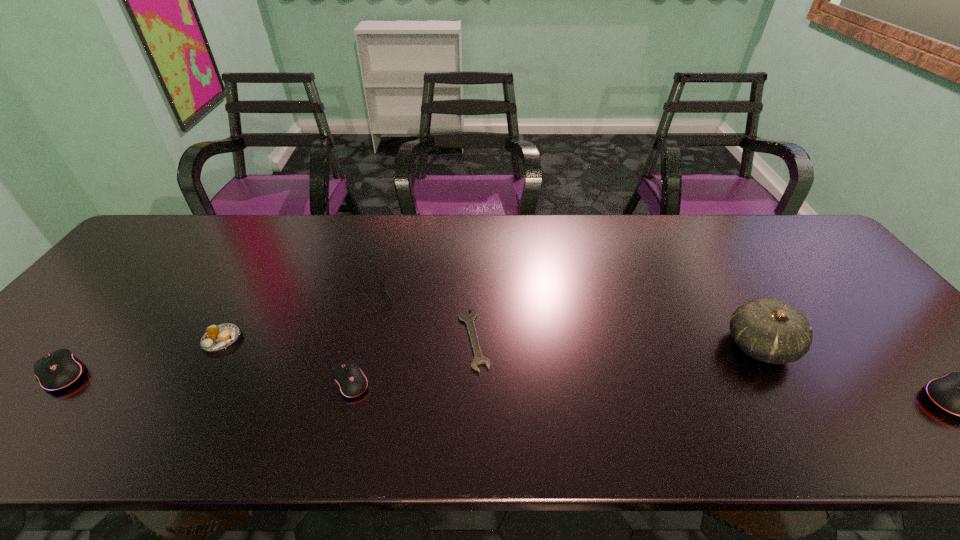
You are a GUI agent. You are given a task and a screenshot of the screen. Output one action in this format:
    pyautogui.click(x=<x>, y=<y>)
    Task: Click on the free spot at the left edge of the desktop
    This screenshot has height=540, width=960.
    Given the screenshot: What is the action you would take?
    pyautogui.click(x=22, y=373)

Locate an element on the screen. The width and height of the screenshot is (960, 540). blank area at the far left corner is located at coordinates pos(148,250).

Locate an element on the screen. The image size is (960, 540). unoccupied area between the second shortest object and the tallest object is located at coordinates (491, 343).

Find the location of `vacant space that's between the second tallest computer mouse and the tallest object`. vacant space that's between the second tallest computer mouse and the tallest object is located at coordinates (411, 360).

Where is `empty space that is in between the leftmost computer mouse and the gourd`? Image resolution: width=960 pixels, height=540 pixels. empty space that is in between the leftmost computer mouse and the gourd is located at coordinates (411, 360).

Identify the location of empty space between the second shortest object and the third tallest object. (142, 356).

Where is `empty space that is in between the leftmost object and the tallest object`? This screenshot has width=960, height=540. empty space that is in between the leftmost object and the tallest object is located at coordinates (411, 360).

Locate an element on the screen. This screenshot has width=960, height=540. free space between the gourd and the spectacles is located at coordinates (565, 319).

This screenshot has height=540, width=960. I want to click on vacant space in between the shortest computer mouse and the spectacles, so tap(361, 337).

What are the coordinates of `object that is the closest to the spectacles` in the screenshot? It's located at (351, 381).